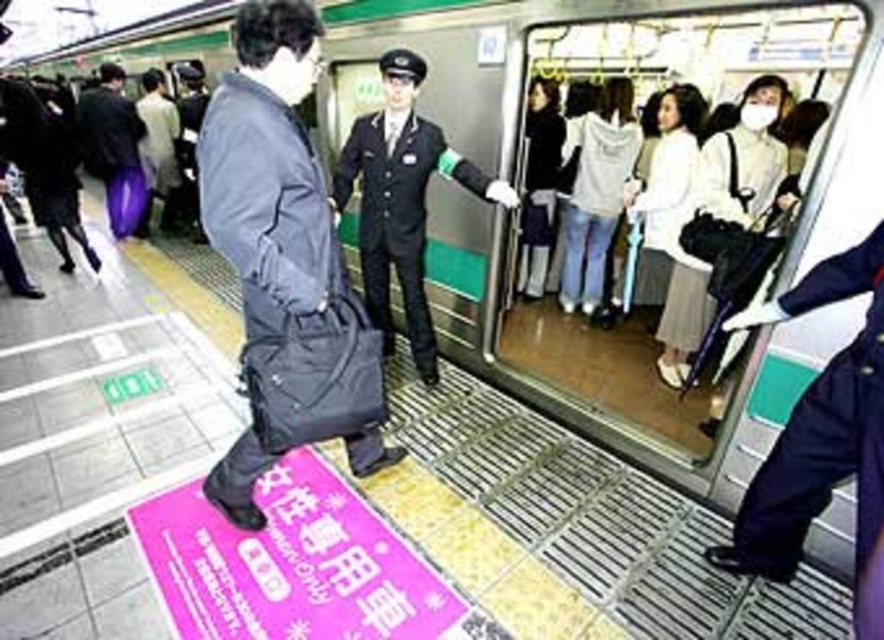
Question: Considering the real-world distances, which object is farthest from the matte black bag at center?

Choices:
 (A) purple fabric bag at left
 (B) black uniform at center

Answer: (A)

Question: Can you confirm if black uniform at center is positioned to the right of purple fabric bag at left?

Choices:
 (A) no
 (B) yes

Answer: (B)

Question: Estimate the real-world distances between objects in this image. Which object is closer to the matte black bag at center?

Choices:
 (A) purple fabric bag at left
 (B) black uniform at center

Answer: (B)

Question: Is matte black bag at center in front of purple fabric bag at left?

Choices:
 (A) yes
 (B) no

Answer: (A)

Question: Considering the relative positions of matte black bag at center and black uniform at center in the image provided, where is matte black bag at center located with respect to black uniform at center?

Choices:
 (A) above
 (B) below

Answer: (B)

Question: Among these points, which one is nearest to the camera?

Choices:
 (A) (90, 116)
 (B) (309, 147)
 (C) (377, 236)

Answer: (B)